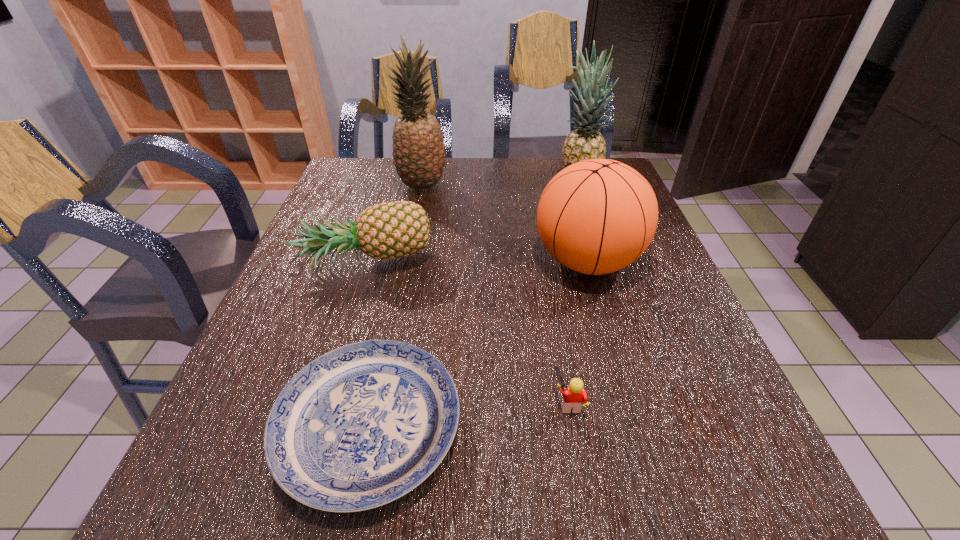
Where is `the rightmost pineapple`? This screenshot has width=960, height=540. the rightmost pineapple is located at coordinates (584, 143).

Identify the location of the fourth shortest object. (597, 216).

This screenshot has height=540, width=960. Find the location of `the shortest pineapple`. the shortest pineapple is located at coordinates (389, 230).

Locate an element on the screen. The width and height of the screenshot is (960, 540). the fourth tallest object is located at coordinates (389, 230).

Locate an element on the screen. the fifth tallest object is located at coordinates (574, 396).

Locate an element on the screen. The height and width of the screenshot is (540, 960). plate is located at coordinates (362, 425).

Identify the location of blank space located on the right of the rightmost pineapple. This screenshot has width=960, height=540. (623, 178).

This screenshot has height=540, width=960. Find the location of `blank space located 0.240m on the front of the fourth shortest object`. blank space located 0.240m on the front of the fourth shortest object is located at coordinates (625, 392).

You are a GUI agent. You are given a task and a screenshot of the screen. Output one action in this format:
    pyautogui.click(x=<x>, y=<y>)
    Task: Click on the free space located 0.180m on the front of the fourth tallest object
    The image size is (960, 540).
    Given the screenshot: What is the action you would take?
    pyautogui.click(x=337, y=360)

Locate an element on the screen. blank space located in front of the Lego with the accessory visible is located at coordinates (496, 402).